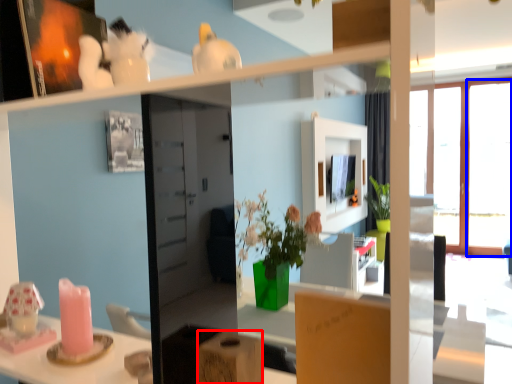
Question: Which object is further to the camera taking this photo, cardboard box (highlighted by a red box) or window (highlighted by a blue box)?

Choices:
 (A) cardboard box
 (B) window

Answer: (B)